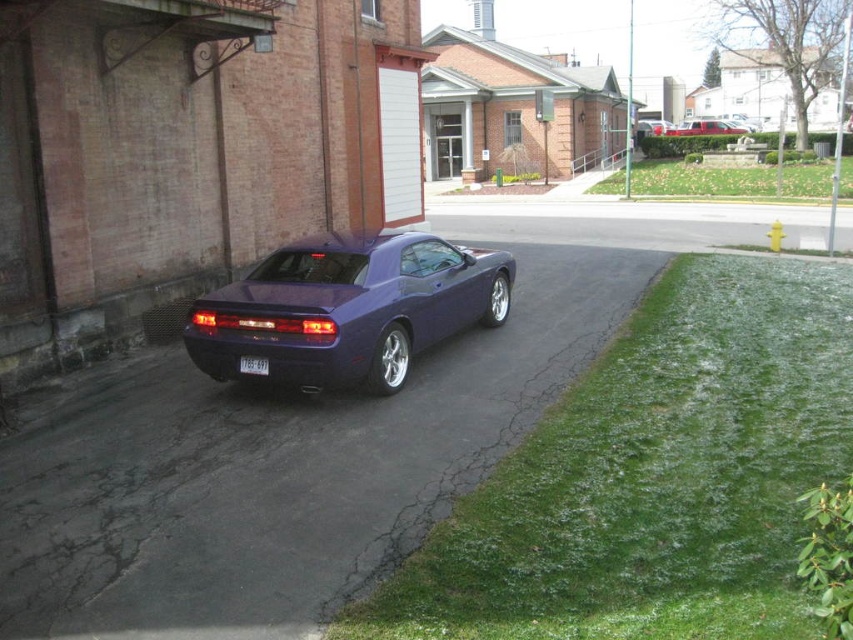
What are the coordinates of the glossy metallic sedan at center?

The glossy metallic sedan at center is located at coordinates point (347, 308).

You are standing in front of the dark purple sports car parked on the cracked asphalt driveway. You notice two points marked in the scene. The first point is at coordinate point [239,364] and the second is at point [672,129]. Which of these points is nearer to your current position?

Point [239,364] is closer to the camera than point [672,129], so the first point is nearer to your current position.

You are standing at the point marked by coordinates point (x=347, y=308) in the urban street scene. What object is exactly at that location?

The glossy metallic sedan at center is located at point (x=347, y=308).